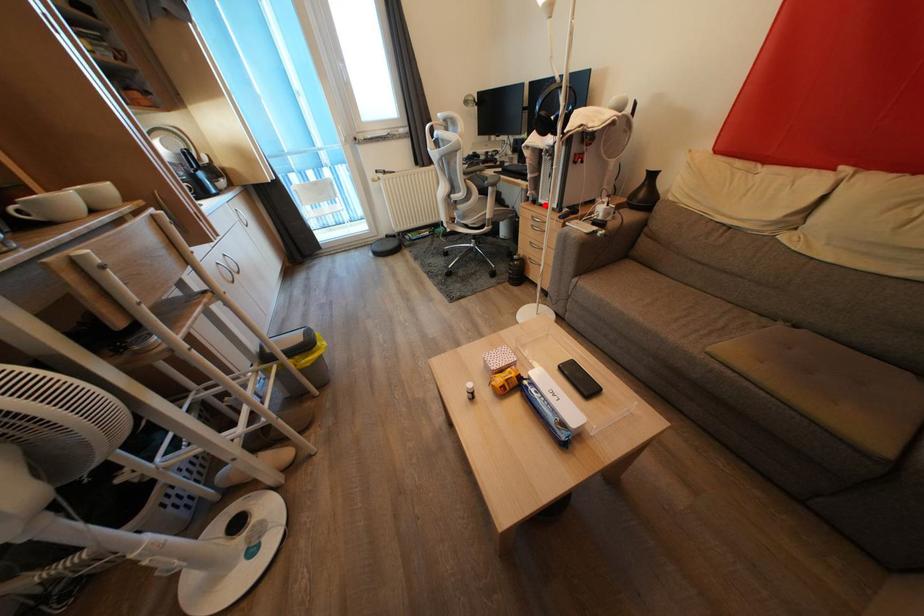
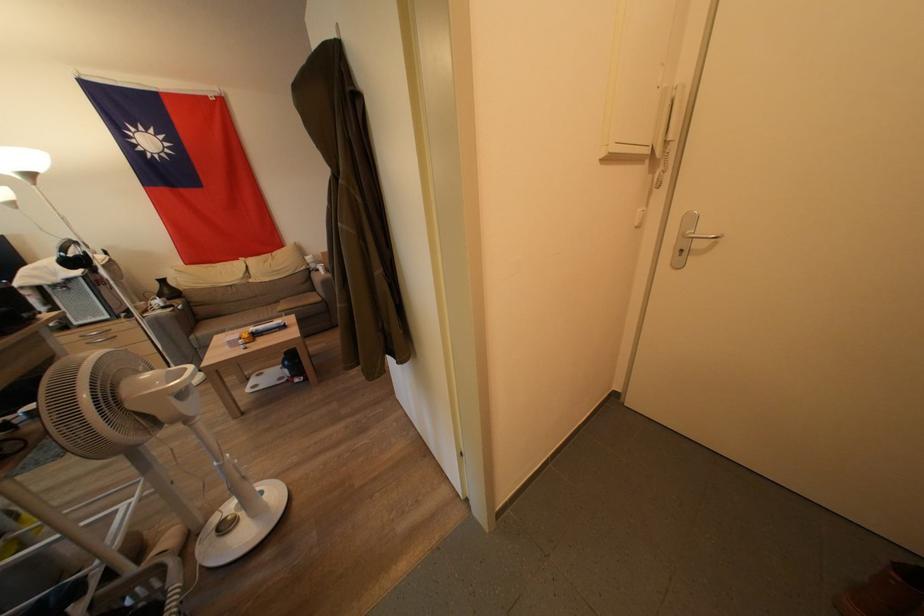
Question: I am providing you with two images of the same scene from different viewpoints. Given a red point in image1, look at the same physical point in image2. Is it:

Choices:
 (A) Closer to the viewpoint
 (B) Farther from the viewpoint

Answer: (B)